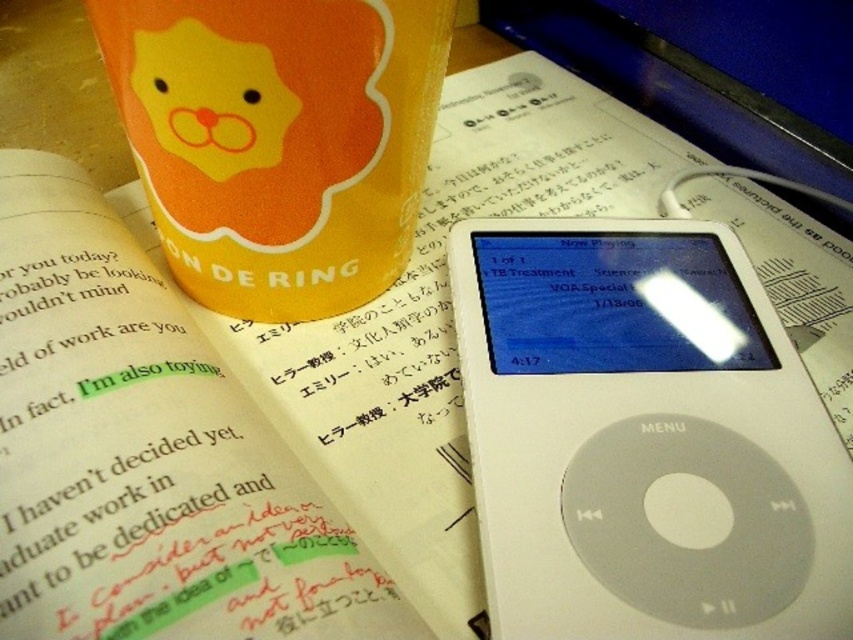
You are setting up a workspace and want to place a small plant on the desk. The plant requires a spot that is not occupied by the white plastic ipod at lower right. Based on the coordinates provided, where should you place the plant?

The white plastic ipod at lower right is located at coordinates point (642,442). To place the plant in an unoccupied area, choose a spot away from these coordinates, such as near the edge of the desk or another free space not overlapping with the iPod.

You are organizing your desk and need to place both the white plastic ipod at lower right and the orange matte cup at upper left into a drawer. The drawer has a width of 15 cm. Can both items fit side by side?

The white plastic ipod at lower right is larger in size than the orange matte cup at upper left. However, without specific measurements, it is impossible to confirm if both items can fit side by side in a 15 cm wide drawer.

You are standing at the point marked by the coordinates point (664,234). You want to place a 0.5 meter wide book on the table without overlapping the white iPod classic. Is there enough space between you and the iPod?

The distance between you and the white iPod classic is 1.22 meters. Since the book is 0.5 meters wide, there is sufficient space to place it without overlapping as 1.22 meters is greater than 0.5 meters.